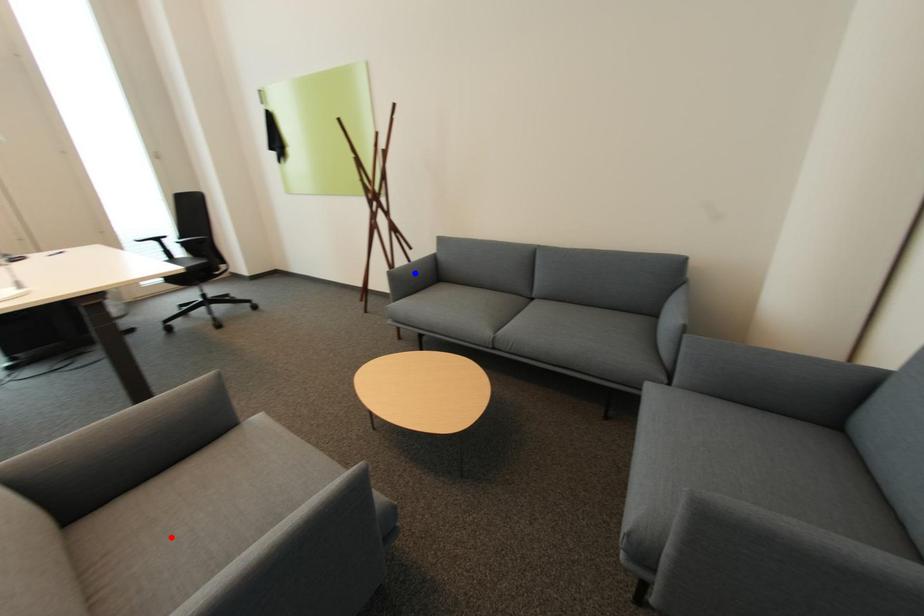
Question: In the image, two points are highlighted. Which point is nearer to the camera? Reply with the corresponding letter.

Choices:
 (A) blue point
 (B) red point

Answer: (B)